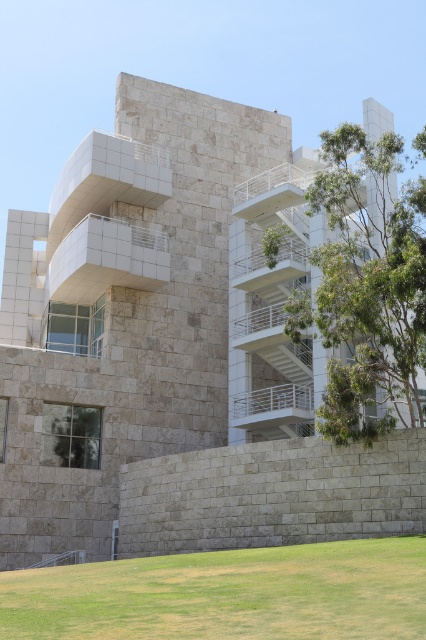
Question: Does green grass at lower center appear under green leafy tree at right?

Choices:
 (A) yes
 (B) no

Answer: (A)

Question: From the image, what is the correct spatial relationship of green grass at lower center in relation to green leafy tree at right?

Choices:
 (A) left
 (B) right

Answer: (A)

Question: Which point is closer to the camera?

Choices:
 (A) (354, 604)
 (B) (319, 416)

Answer: (A)

Question: Which point is closer to the camera taking this photo?

Choices:
 (A) (356, 134)
 (B) (112, 564)

Answer: (B)

Question: Which point is closer to the camera taking this photo?

Choices:
 (A) (397, 147)
 (B) (218, 566)

Answer: (B)

Question: Can you confirm if green grass at lower center is positioned to the right of green leafy tree at right?

Choices:
 (A) yes
 (B) no

Answer: (B)